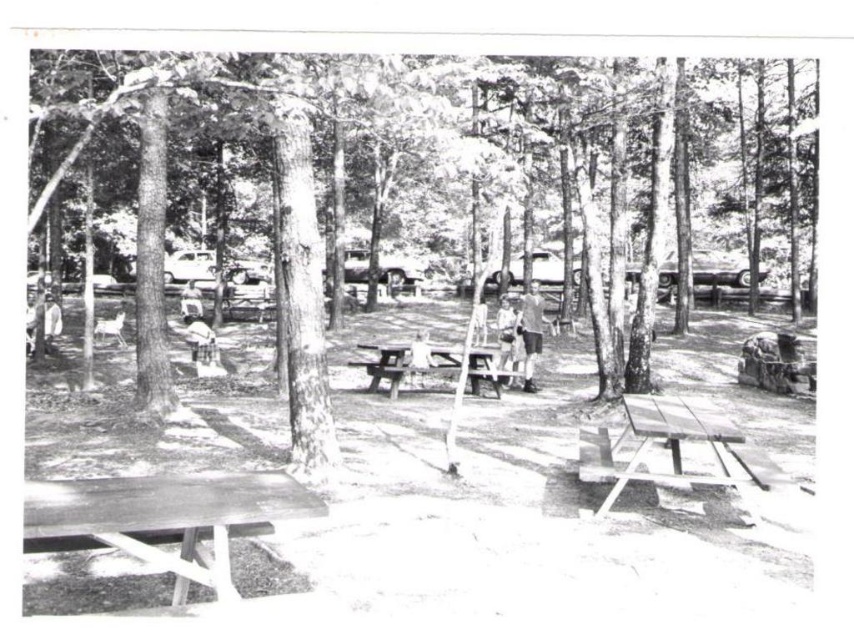
Between point (506, 381) and point (189, 301), which one is positioned in front?

Point (506, 381)

Can you confirm if wooden picnic table at center is smaller than smooth white shirt at center?

Indeed, wooden picnic table at center has a smaller size compared to smooth white shirt at center.

What are the coordinates of `wooden picnic table at center` in the screenshot? It's located at (401, 364).

Identify the location of wooden picnic table at center. This screenshot has width=854, height=640. (401, 364).

Does light brown fabric shirt at center appear under smooth white shirt at center?

Indeed, light brown fabric shirt at center is positioned under smooth white shirt at center.

Between point (535, 330) and point (197, 289), which one is positioned behind?

Positioned behind is point (197, 289).

Locate an element on the screen. light brown fabric shirt at center is located at coordinates (530, 332).

Describe the element at coordinates (676, 456) in the screenshot. The width and height of the screenshot is (854, 640). I see `wooden picnic table at lower right` at that location.

Between point (700, 429) and point (427, 348), which one is positioned behind?

Point (427, 348)

At what (x,y) coordinates should I click in order to perform the action: click on wooden picnic table at lower right. Please return your answer as a coordinate pair (x, y). Looking at the image, I should click on (676, 456).